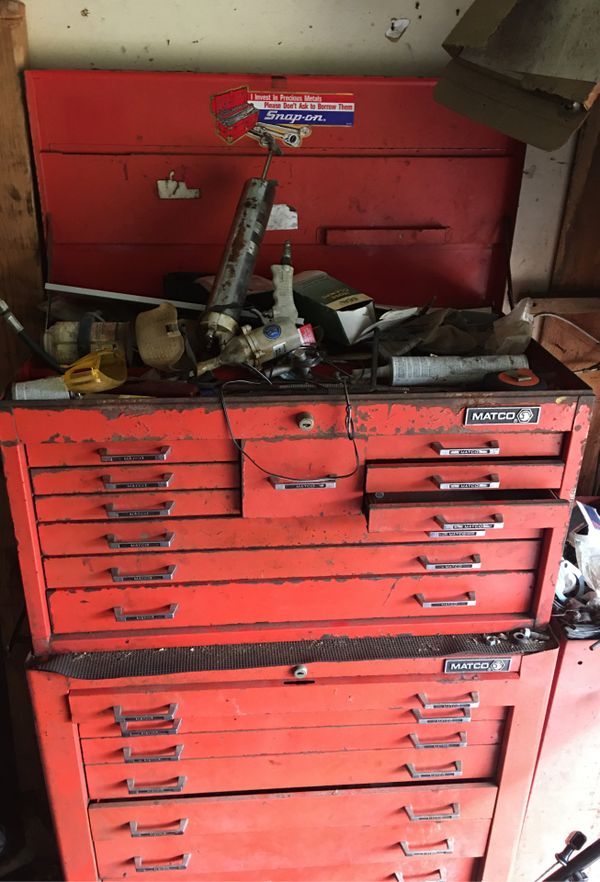
The height and width of the screenshot is (882, 600). Identify the location of shelf. (10, 147).